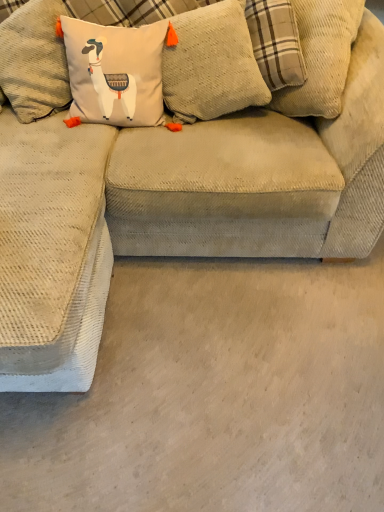
Question: Should I look upward or downward to see beige corduroy couch at center?

Choices:
 (A) up
 (B) down

Answer: (A)

Question: Should I look upward or downward to see textured beige pillow at upper center?

Choices:
 (A) down
 (B) up

Answer: (B)

Question: Would you say textured beige pillow at upper center is part of beige corduroy couch at center's contents?

Choices:
 (A) no
 (B) yes

Answer: (A)

Question: Can you confirm if beige corduroy couch at center is thinner than textured beige pillow at upper center?

Choices:
 (A) no
 (B) yes

Answer: (A)

Question: Does beige corduroy couch at center have a greater width compared to textured beige pillow at upper center?

Choices:
 (A) no
 (B) yes

Answer: (B)

Question: Can you confirm if beige corduroy couch at center is positioned to the right of textured beige pillow at upper center?

Choices:
 (A) no
 (B) yes

Answer: (B)

Question: Is beige corduroy couch at center closer to camera compared to textured beige pillow at upper center?

Choices:
 (A) no
 (B) yes

Answer: (B)

Question: Is beige corduroy couch at center shorter than textured beige pillow at upper center?

Choices:
 (A) yes
 (B) no

Answer: (A)

Question: Is textured beige pillow at upper center bigger than beige corduroy couch at center?

Choices:
 (A) no
 (B) yes

Answer: (A)

Question: Is textured beige pillow at upper center turned away from beige corduroy couch at center?

Choices:
 (A) yes
 (B) no

Answer: (B)

Question: Is textured beige pillow at upper center aimed at beige corduroy couch at center?

Choices:
 (A) yes
 (B) no

Answer: (B)

Question: Can you confirm if textured beige pillow at upper center is positioned to the left of beige corduroy couch at center?

Choices:
 (A) yes
 (B) no

Answer: (A)

Question: Is textured beige pillow at upper center at the right side of beige corduroy couch at center?

Choices:
 (A) yes
 (B) no

Answer: (B)

Question: Is textured beige pillow at upper center in contact with beige corduroy couch at center?

Choices:
 (A) yes
 (B) no

Answer: (B)

Question: From a real-world perspective, is beige corduroy couch at center physically located above or below textured beige pillow at upper center?

Choices:
 (A) above
 (B) below

Answer: (B)